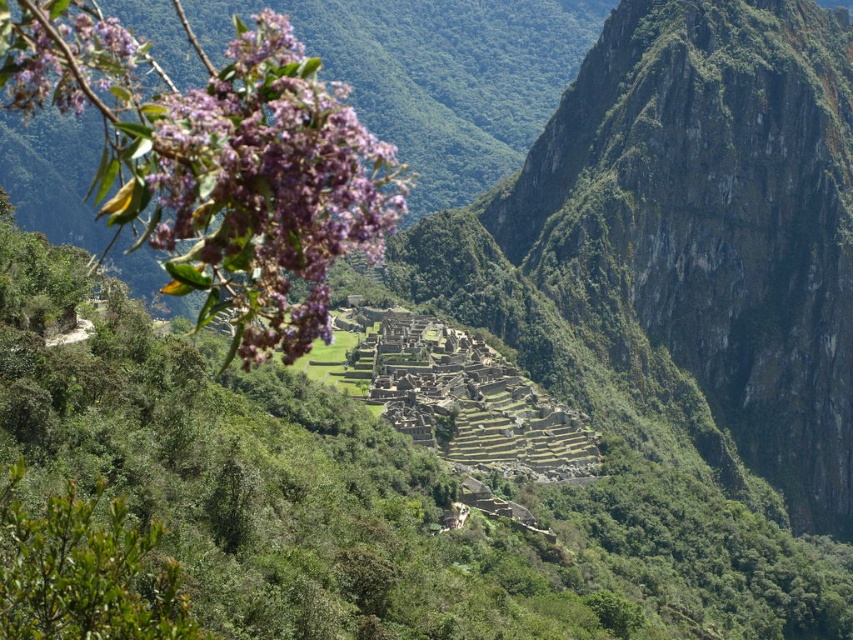
How distant is purple matte flowers at upper left from purple matte flower at upper left?

They are 153.54 meters apart.

Is point (207, 204) closer to viewer compared to point (100, 45)?

Yes, it is in front of point (100, 45).

Does point (265, 202) come closer to viewer compared to point (86, 93)?

Yes, it is.

At what (x,y) coordinates should I click in order to perform the action: click on purple matte flowers at upper left. Please return your answer as a coordinate pair (x, y). This screenshot has height=640, width=853. Looking at the image, I should click on (268, 189).